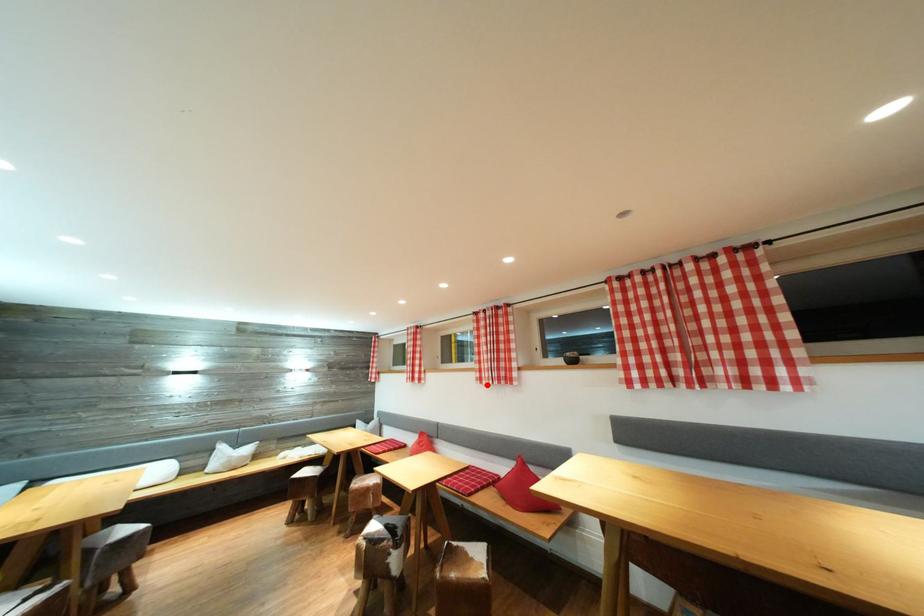
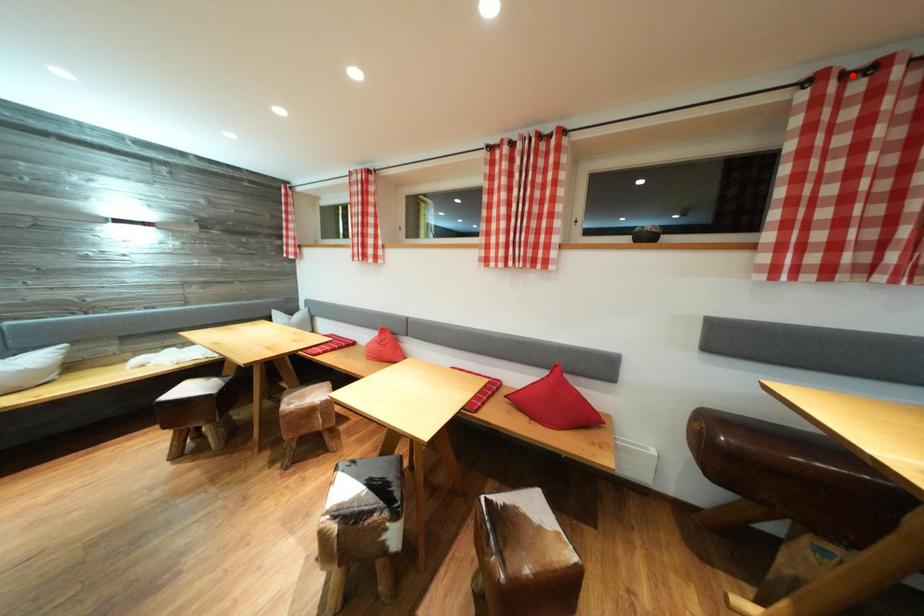
I am providing you with two images of the same scene from different viewpoints. A red point is marked on the first image and another point is marked on the second image. Are the points marked in image1 and image2 representing the same 3D position?

No